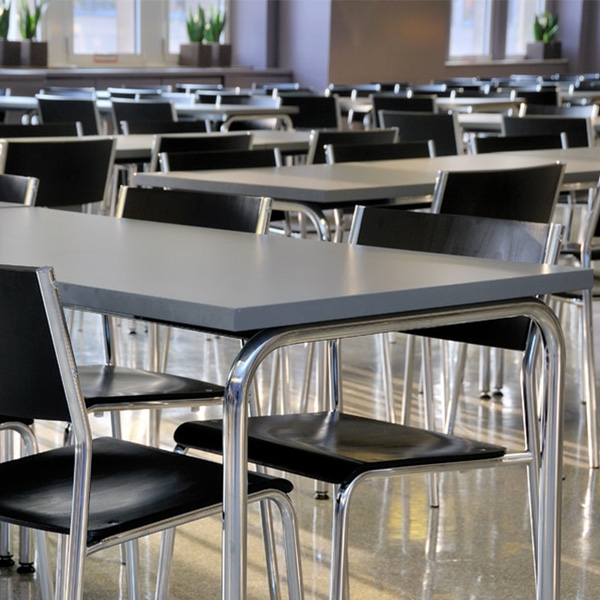
Image resolution: width=600 pixels, height=600 pixels. Identify the location of plant pot. (11, 55), (28, 56), (186, 53), (215, 55), (534, 54).